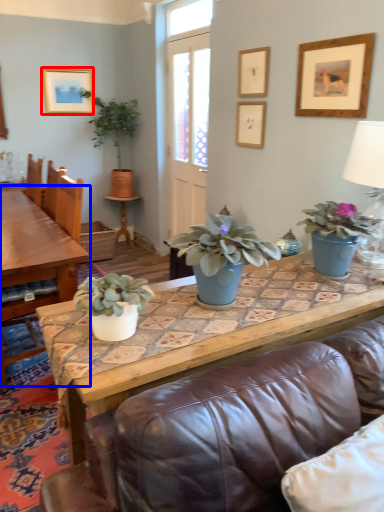
Question: Which object is further to the camera taking this photo, picture frame (highlighted by a red box) or coffee table (highlighted by a blue box)?

Choices:
 (A) picture frame
 (B) coffee table

Answer: (A)